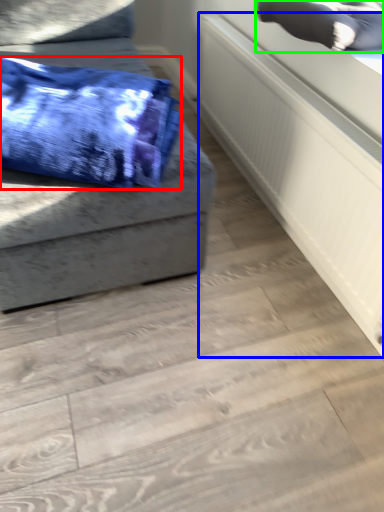
Question: Considering the real-world distances, which object is closest to blanket (highlighted by a red box)? radiator (highlighted by a blue box) or pillow (highlighted by a green box).

Choices:
 (A) radiator
 (B) pillow

Answer: (A)